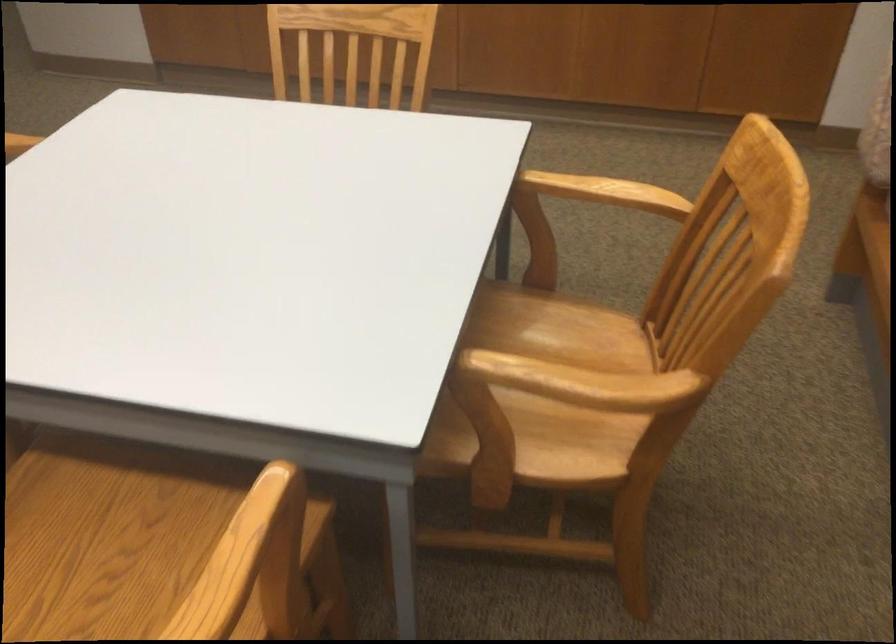
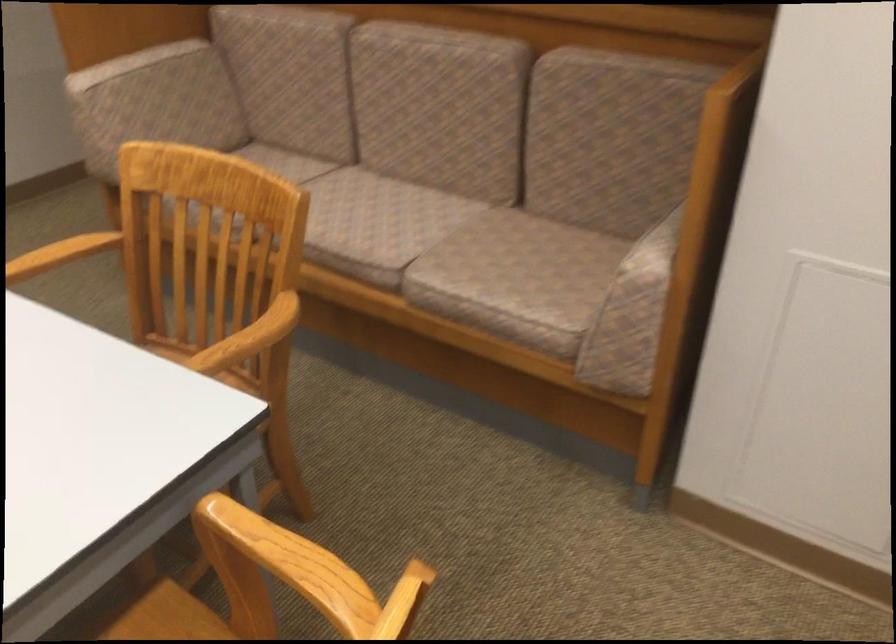
Question: The camera is either moving clockwise (left) or counter-clockwise (right) around the object. The first image is from the beginning of the video and the second image is from the end. Is the camera moving left or right when shooting the video?

Choices:
 (A) Left
 (B) Right

Answer: (A)